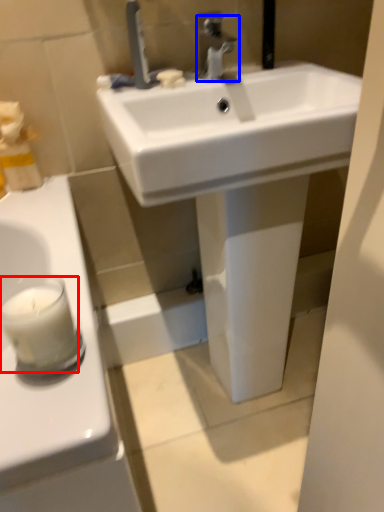
Question: Which of the following is the closest to the observer, candle (highlighted by a red box) or tap (highlighted by a blue box)?

Choices:
 (A) candle
 (B) tap

Answer: (A)